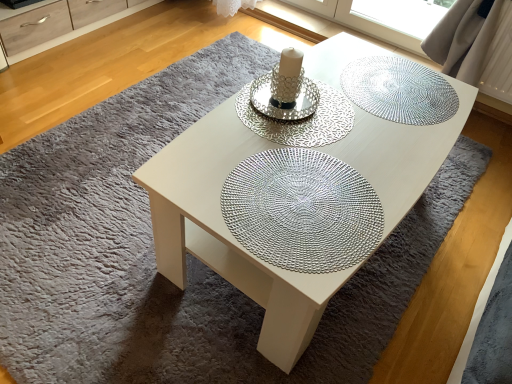
Question: Considering the relative sizes of white glossy coffee table at center and matte wood dresser at upper left in the image provided, is white glossy coffee table at center thinner than matte wood dresser at upper left?

Choices:
 (A) yes
 (B) no

Answer: (B)

Question: Considering the relative positions of white glossy coffee table at center and matte wood dresser at upper left in the image provided, is white glossy coffee table at center behind matte wood dresser at upper left?

Choices:
 (A) no
 (B) yes

Answer: (A)

Question: Is white glossy coffee table at center positioned before matte wood dresser at upper left?

Choices:
 (A) no
 (B) yes

Answer: (B)

Question: From the image's perspective, is white glossy coffee table at center located above matte wood dresser at upper left?

Choices:
 (A) no
 (B) yes

Answer: (A)

Question: Is white glossy coffee table at center with matte wood dresser at upper left?

Choices:
 (A) no
 (B) yes

Answer: (A)

Question: Based on their sizes in the image, would you say silver metallic doily at center, the second glass plate when ordered from front to back, is bigger or smaller than silver textured doily at center, the first glass plate in the front-to-back sequence?

Choices:
 (A) small
 (B) big

Answer: (A)

Question: Choose the correct answer: Is silver metallic doily at center, the second glass plate when ordered from front to back, inside silver textured doily at center, the first glass plate in the front-to-back sequence, or outside it?

Choices:
 (A) outside
 (B) inside

Answer: (A)

Question: From the image's perspective, is silver metallic doily at center, the 2th glass plate in the back-to-front sequence, above or below silver textured doily at center, the first glass plate in the front-to-back sequence?

Choices:
 (A) below
 (B) above

Answer: (B)

Question: In the image, is silver metallic doily at center, the 2th glass plate in the back-to-front sequence, positioned in front of or behind silver textured doily at center, the first glass plate in the front-to-back sequence?

Choices:
 (A) behind
 (B) front

Answer: (A)

Question: From a real-world perspective, relative to matte wood dresser at upper left, is silver metallic doily at center, the 2th glass plate in the back-to-front sequence, vertically above or below?

Choices:
 (A) above
 (B) below

Answer: (A)

Question: Considering the positions of silver metallic doily at center, the 2th glass plate in the back-to-front sequence, and matte wood dresser at upper left in the image, is silver metallic doily at center, the 2th glass plate in the back-to-front sequence, taller or shorter than matte wood dresser at upper left?

Choices:
 (A) tall
 (B) short

Answer: (B)

Question: Relative to matte wood dresser at upper left, is silver metallic doily at center, the 2th glass plate in the back-to-front sequence, in front or behind?

Choices:
 (A) behind
 (B) front

Answer: (B)

Question: From the image's perspective, relative to matte wood dresser at upper left, is silver metallic doily at center, the second glass plate when ordered from front to back, above or below?

Choices:
 (A) below
 (B) above

Answer: (A)

Question: In terms of size, does matte wood dresser at upper left appear bigger or smaller than silver metallic doily at center, the 2th glass plate in the back-to-front sequence?

Choices:
 (A) big
 (B) small

Answer: (A)

Question: Considering the positions of matte wood dresser at upper left and silver metallic doily at center, the second glass plate when ordered from front to back, in the image, is matte wood dresser at upper left taller or shorter than silver metallic doily at center, the second glass plate when ordered from front to back,?

Choices:
 (A) tall
 (B) short

Answer: (A)